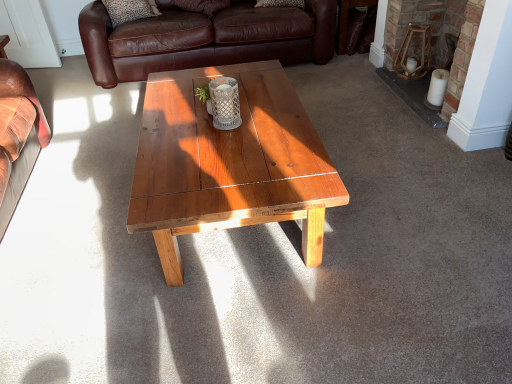
You are a GUI agent. You are given a task and a screenshot of the screen. Output one action in this format:
    pyautogui.click(x=<x>, y=<y>)
    Task: Click on the wooden stool at upper right
    The width and height of the screenshot is (512, 384).
    Given the screenshot: What is the action you would take?
    [414, 53]

You are a GUI agent. You are given a task and a screenshot of the screen. Output one action in this format:
    pyautogui.click(x=<x>, y=<y>)
    Task: Click on the brick fireplace at right
    The height and width of the screenshot is (384, 512).
    Given the screenshot: What is the action you would take?
    coord(436,45)

Considering the relative sizes of brown leather couch at upper center and brick fireplace at right in the image provided, is brown leather couch at upper center taller than brick fireplace at right?

No, brown leather couch at upper center is not taller than brick fireplace at right.

Between point (176, 28) and point (443, 21), which one is positioned behind?

The point (176, 28) is farther.

Could you tell me if brown leather couch at upper center is turned towards brick fireplace at right?

No.

Is brown leather couch at upper center spatially inside brick fireplace at right, or outside of it?

brown leather couch at upper center is located beyond the bounds of brick fireplace at right.

Between leopard print fabric pillow at upper left and brick fireplace at right, which one has smaller size?

leopard print fabric pillow at upper left.

Considering the sizes of objects leopard print fabric pillow at upper left and brick fireplace at right in the image provided, who is wider, leopard print fabric pillow at upper left or brick fireplace at right?

With larger width is brick fireplace at right.

Does leopard print fabric pillow at upper left appear on the right side of brick fireplace at right?

No, leopard print fabric pillow at upper left is not to the right of brick fireplace at right.

Based on their positions, is brick fireplace at right located to the left or right of brown leather couch at upper center?

From the image, it's evident that brick fireplace at right is to the right of brown leather couch at upper center.

Is brick fireplace at right taller than brown leather couch at upper center?

Yes, brick fireplace at right is taller than brown leather couch at upper center.

Can brown leather couch at upper center be found inside brick fireplace at right?

No, brown leather couch at upper center is not surrounded by brick fireplace at right.

From the image's perspective, is brick fireplace at right over brown leather couch at upper center?

No.

Could you tell me if brick fireplace at right is turned towards brown leather side table at upper right?

No, brick fireplace at right is not aimed at brown leather side table at upper right.

Between brick fireplace at right and brown leather side table at upper right, which one is positioned behind?

brown leather side table at upper right is further from the camera.

In terms of size, does brick fireplace at right appear bigger or smaller than brown leather side table at upper right?

brick fireplace at right is bigger than brown leather side table at upper right.

Where is `fireplace above the brown leather side table at upper right (from a real-world perspective)`? The image size is (512, 384). fireplace above the brown leather side table at upper right (from a real-world perspective) is located at coordinates (436, 45).

Choose the correct answer: Is wooden stool at upper right inside brown leather side table at upper right or outside it?

The correct answer is: outside.

Is wooden stool at upper right positioned with its back to brown leather side table at upper right?

wooden stool at upper right does not have its back to brown leather side table at upper right.

Locate an element on the screen. side table below the wooden stool at upper right (from a real-world perspective) is located at coordinates (347, 20).

From the image's perspective, who appears lower, leopard print fabric pillow at upper left or wooden stool at upper right?

wooden stool at upper right, from the image's perspective.

Which object is more forward, leopard print fabric pillow at upper left or wooden stool at upper right?

wooden stool at upper right is in front.

How many degrees apart are the facing directions of leopard print fabric pillow at upper left and wooden stool at upper right?

The facing directions of leopard print fabric pillow at upper left and wooden stool at upper right are 91.3 degrees apart.

From the picture: From a real-world perspective, is leopard print fabric pillow at upper left on top of wooden stool at upper right?

Indeed, from a real-world perspective, leopard print fabric pillow at upper left stands above wooden stool at upper right.

Is brown leather side table at upper right not inside brown leather couch at upper center?

Yes, brown leather side table at upper right is not within brown leather couch at upper center.

Locate an element on the screen. The image size is (512, 384). side table located behind the brown leather couch at upper center is located at coordinates (347, 20).

Which is closer to the camera, (355, 2) or (302, 44)?

The point (302, 44) is closer to the camera.

Considering the positions of objects brown leather side table at upper right and brown leather couch at upper center in the image provided, who is behind, brown leather side table at upper right or brown leather couch at upper center?

Positioned behind is brown leather side table at upper right.

Image resolution: width=512 pixels, height=384 pixels. What are the coordinates of `studio couch below the brick fireplace at right (from a real-world perspective)` in the screenshot? It's located at (205, 38).

Image resolution: width=512 pixels, height=384 pixels. I want to click on fireplace on the right of leopard print fabric pillow at upper left, so click(436, 45).

Based on their spatial positions, is brown leather side table at upper right or brown leather couch at upper center further from leopard print fabric pillow at upper left?

brown leather side table at upper right is positioned further to the anchor leopard print fabric pillow at upper left.

Looking at this image, when comparing their distances from brick fireplace at right, does wooden stool at upper right or brown leather couch at upper center seem closer?

Based on the image, wooden stool at upper right appears to be nearer to brick fireplace at right.

From the image, which object appears to be nearer to leopard print fabric pillow at upper left, wooden stool at upper right or brown leather side table at upper right?

Based on the image, brown leather side table at upper right appears to be nearer to leopard print fabric pillow at upper left.

Based on their spatial positions, is brick fireplace at right or brown leather side table at upper right further from wooden stool at upper right?

brown leather side table at upper right lies further to wooden stool at upper right than the other object.

From the image, which object appears to be farther from brown leather couch at upper center, brown leather side table at upper right or leopard print fabric pillow at upper left?

The object further to brown leather couch at upper center is brown leather side table at upper right.

Estimate the real-world distances between objects in this image. Which object is further from leopard print fabric pillow at upper left, brick fireplace at right or brown leather couch at upper center?

brick fireplace at right is positioned further to the anchor leopard print fabric pillow at upper left.

From the image, which object appears to be nearer to wooden stool at upper right, leopard print fabric pillow at upper left or brown leather couch at upper center?

Based on the image, brown leather couch at upper center appears to be nearer to wooden stool at upper right.

Looking at the image, which one is located further to brown leather side table at upper right, wooden stool at upper right or brick fireplace at right?

Among the two, wooden stool at upper right is located further to brown leather side table at upper right.

The image size is (512, 384). I want to click on stool located between brick fireplace at right and brown leather side table at upper right in the depth direction, so click(414, 53).

Find the location of `studio couch between leopard print fabric pillow at upper left and wooden stool at upper right in the horizontal direction`. studio couch between leopard print fabric pillow at upper left and wooden stool at upper right in the horizontal direction is located at coordinates (205, 38).

At what (x,y) coordinates should I click in order to perform the action: click on stool between leopard print fabric pillow at upper left and brick fireplace at right in the horizontal direction. Please return your answer as a coordinate pair (x, y). Image resolution: width=512 pixels, height=384 pixels. Looking at the image, I should click on (414, 53).

Find the location of a particular element. side table between leopard print fabric pillow at upper left and wooden stool at upper right from left to right is located at coordinates (347, 20).